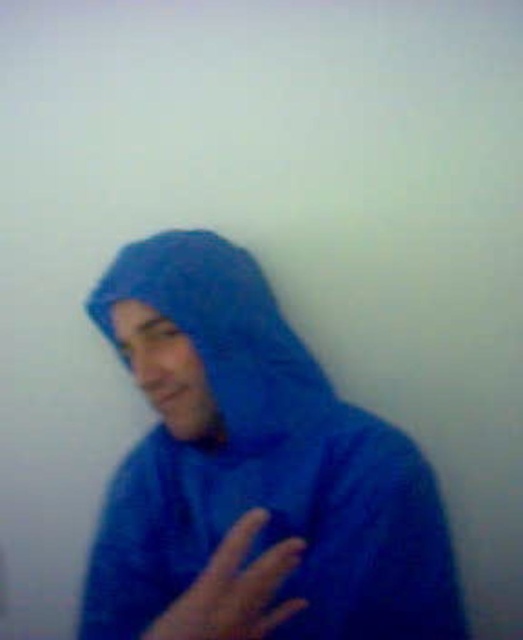
Does blue fabric hoodie at center have a greater width compared to blue fabric hood at center?

Correct, the width of blue fabric hoodie at center exceeds that of blue fabric hood at center.

Does blue fabric hoodie at center have a lesser width compared to blue fabric hood at center?

In fact, blue fabric hoodie at center might be wider than blue fabric hood at center.

Is point (186, 541) closer to camera compared to point (259, 426)?

No, (186, 541) is behind (259, 426).

You are a GUI agent. You are given a task and a screenshot of the screen. Output one action in this format:
    pyautogui.click(x=<x>, y=<y>)
    Task: Click on the blue fabric hoodie at center
    
    Given the screenshot: What is the action you would take?
    pyautogui.click(x=248, y=452)

From the picture: Does blue fabric hoodie at center appear on the left side of blue fabric hand at center?

A: Yes, blue fabric hoodie at center is to the left of blue fabric hand at center.

Is blue fabric hoodie at center above blue fabric hand at center?

Yes, blue fabric hoodie at center is above blue fabric hand at center.

Does point (106, 627) come closer to viewer compared to point (271, 589)?

That is False.

Identify the location of blue fabric hoodie at center. The width and height of the screenshot is (523, 640). (248, 452).

From the picture: Which is more to the left, blue fabric hood at center or blue fabric hand at center?

Positioned to the left is blue fabric hood at center.

Between blue fabric hood at center and blue fabric hand at center, which one is positioned higher?

blue fabric hood at center

What do you see at coordinates (221, 328) in the screenshot? The width and height of the screenshot is (523, 640). I see `blue fabric hood at center` at bounding box center [221, 328].

Locate an element on the screen. The height and width of the screenshot is (640, 523). blue fabric hood at center is located at coordinates tap(221, 328).